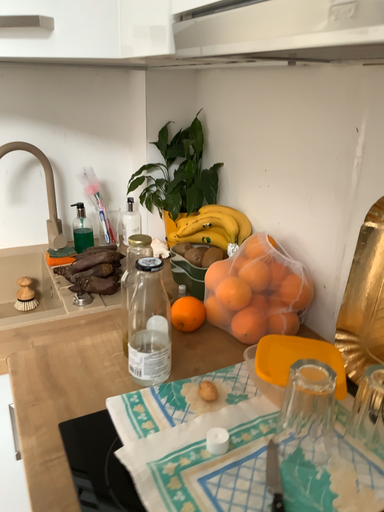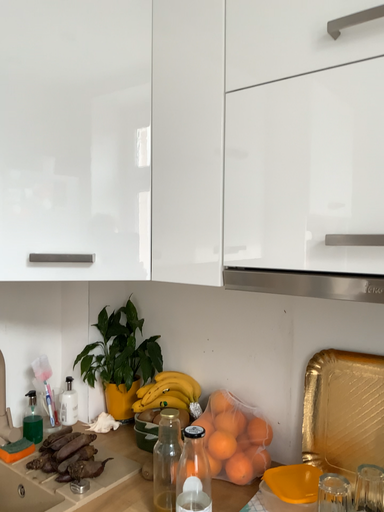
Question: How did the camera likely rotate when shooting the video?

Choices:
 (A) rotated left
 (B) rotated right

Answer: (B)